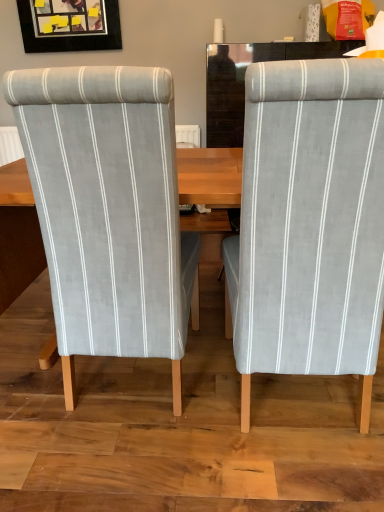
Locate an element on the screen. free location to the left of light gray fabric chair at right, which is the second chair in left-to-right order is located at coordinates (165, 430).